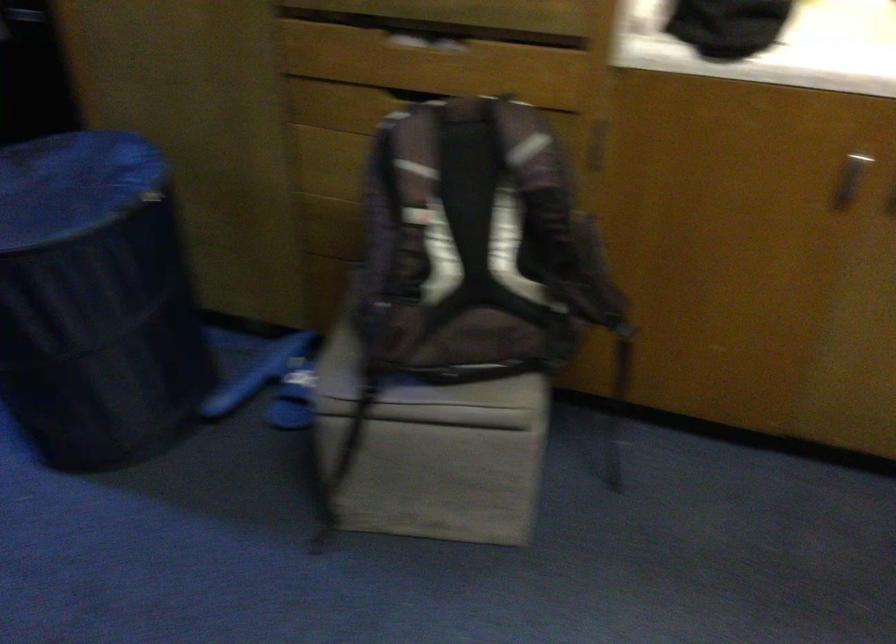
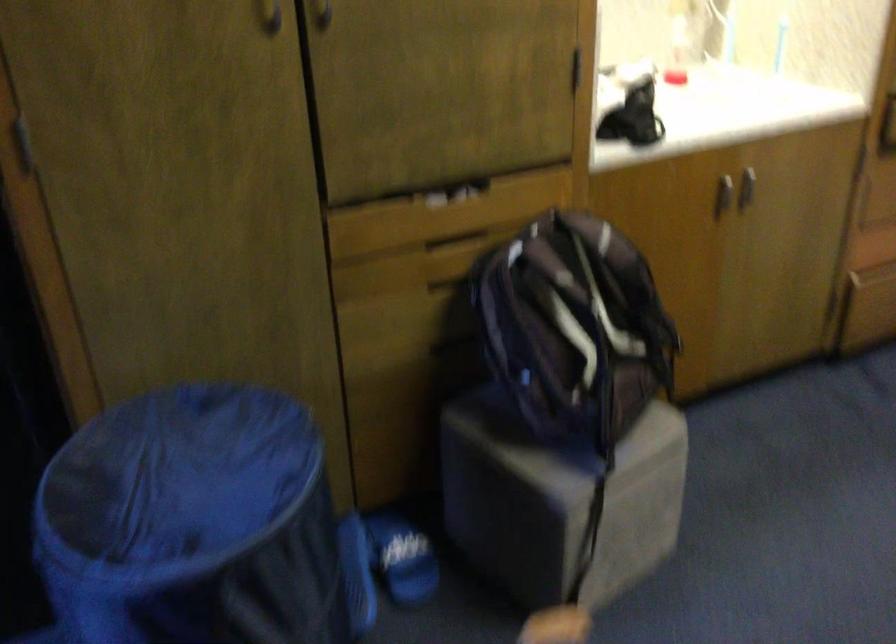
Where in the second image is the point corresponding to [530,242] from the first image?

(607, 310)